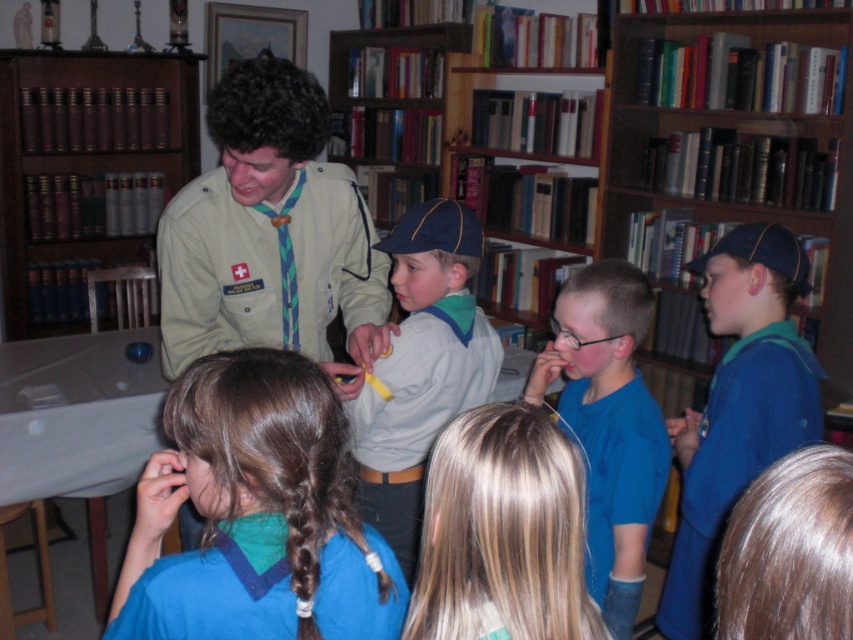
Question: Observing the image, what is the correct spatial positioning of light gray sweater at center in reference to blue fabric uniform at right?

Choices:
 (A) below
 (B) above

Answer: (B)

Question: Can you confirm if wooden bookshelf at upper center is wider than blue matte shirt at center?

Choices:
 (A) no
 (B) yes

Answer: (B)

Question: Among these objects, which one is farthest from the camera?

Choices:
 (A) light green uniform at center
 (B) blonde hair at lower right
 (C) light gray sweater at center
 (D) blue matte shirt at center

Answer: (C)

Question: Can you confirm if blue matte shirt at center is bigger than blonde hair at lower right?

Choices:
 (A) yes
 (B) no

Answer: (A)

Question: Estimate the real-world distances between objects in this image. Which object is farther from the light gray sweater at center?

Choices:
 (A) blonde hair at center
 (B) brown leather bookshelf at upper left

Answer: (B)

Question: Among these objects, which one is nearest to the camera?

Choices:
 (A) blonde hair at lower right
 (B) blue fabric uniform at right

Answer: (A)